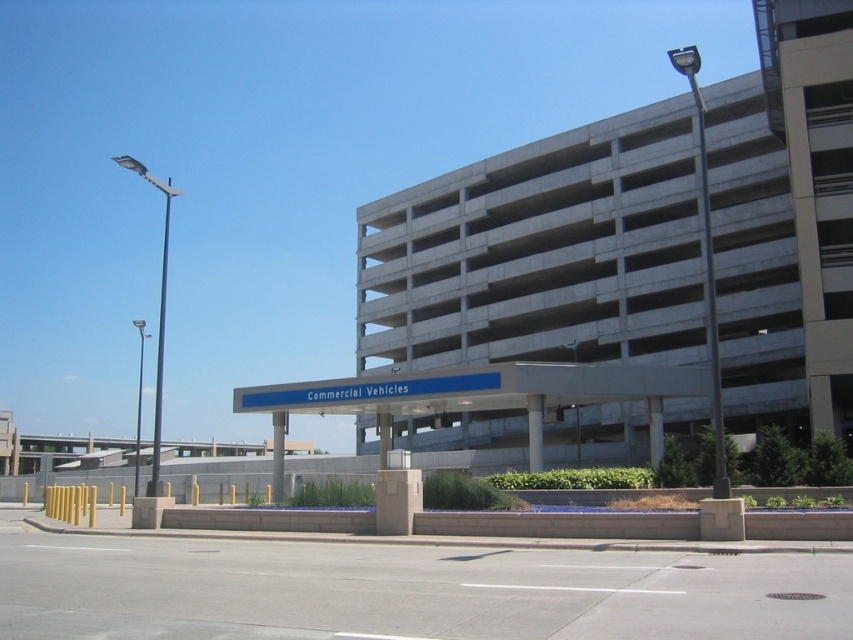
You are a delivery driver arriving at a parking lot. You need to park your large truck in the Commercial Vehicles section. The gray concrete parking garage at upper center and the metallic blue sign at upper center are visible. Which object should you look for to find the correct parking area?

You should look for the metallic blue sign at upper center because it indicates the Commercial Vehicles section, and the gray concrete parking garage at upper center is located above it, so the sign is likely pointing to the designated area below.

You are a delivery driver looking for a parking spot for your truck. You see the gray concrete parking garage at upper center and the metallic blue sign at upper center. Which object is larger in size?

The metallic blue sign at upper center is larger than the gray concrete parking garage at upper center.